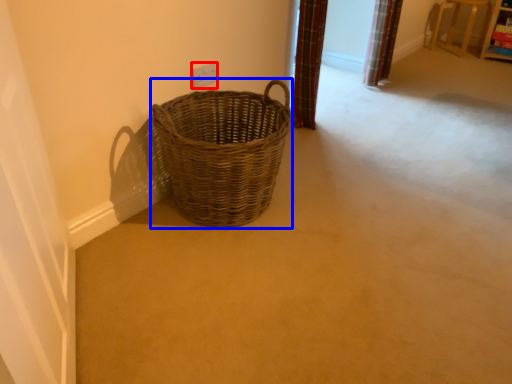
Question: Which point is further to the camera, electric outlet (highlighted by a red box) or picnic basket (highlighted by a blue box)?

Choices:
 (A) electric outlet
 (B) picnic basket

Answer: (A)